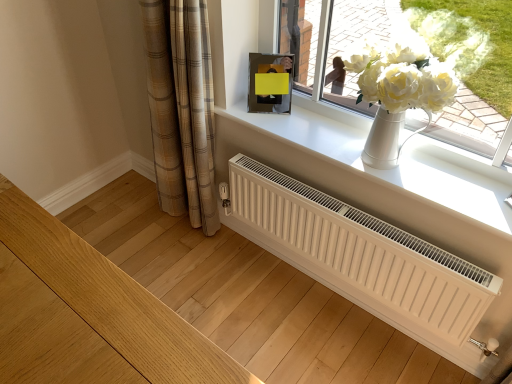
Locate an element on the screen. free point below white matte radiator at center (from a real-world perspective) is located at coordinates (328, 300).